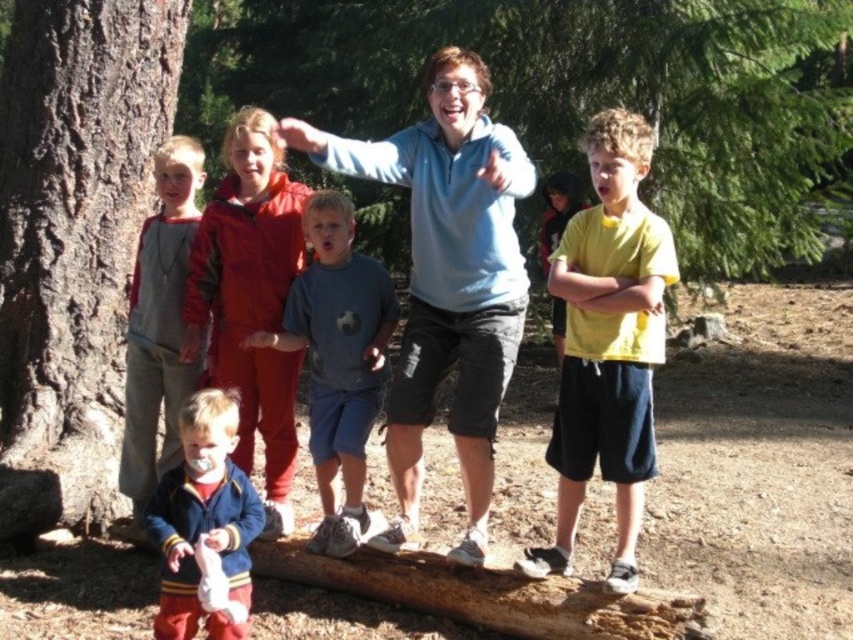
Question: Does matte blue hoodie at center have a greater width compared to velvet blue jacket at lower left?

Choices:
 (A) no
 (B) yes

Answer: (B)

Question: Which point is closer to the camera?

Choices:
 (A) (537, 609)
 (B) (107, 83)
 (C) (396, 152)
 (D) (457, 262)

Answer: (A)

Question: Is velvet blue jacket at center further to camera compared to brown rough log at center?

Choices:
 (A) no
 (B) yes

Answer: (B)

Question: Among these objects, which one is nearest to the camera?

Choices:
 (A) gray matte soccer ball at center
 (B) velvet blue jacket at lower left
 (C) brown rough bark at center

Answer: (B)

Question: Which point is farther to the camera?

Choices:
 (A) light blue fleece at center
 (B) matte blue hoodie at center
 (C) gray fleece jacket at left

Answer: (C)

Question: Is matte blue hoodie at center positioned behind velvet blue jacket at center?

Choices:
 (A) yes
 (B) no

Answer: (B)